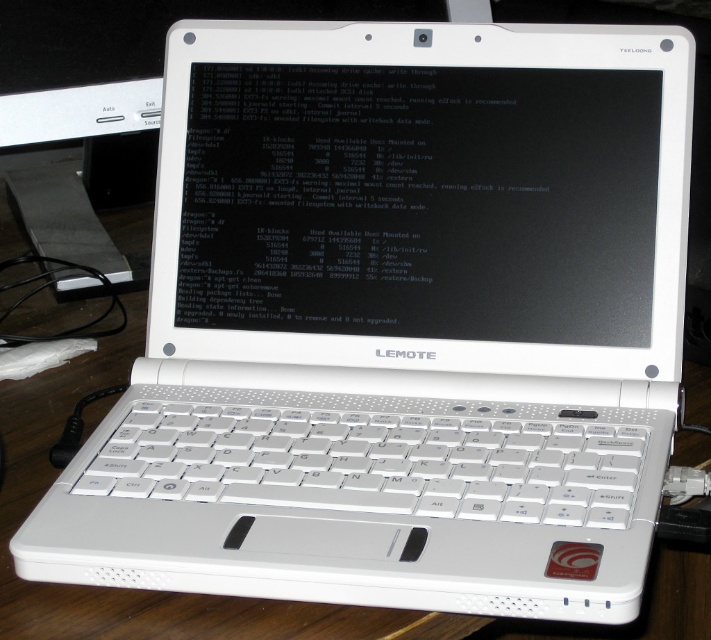
Does white plastic keyboard at center have a greater width compared to white glossy computer monitor at center?

No, white plastic keyboard at center is not wider than white glossy computer monitor at center.

What do you see at coordinates (373, 461) in the screenshot? I see `white plastic keyboard at center` at bounding box center [373, 461].

The height and width of the screenshot is (640, 711). What are the coordinates of `white plastic keyboard at center` in the screenshot? It's located at (373, 461).